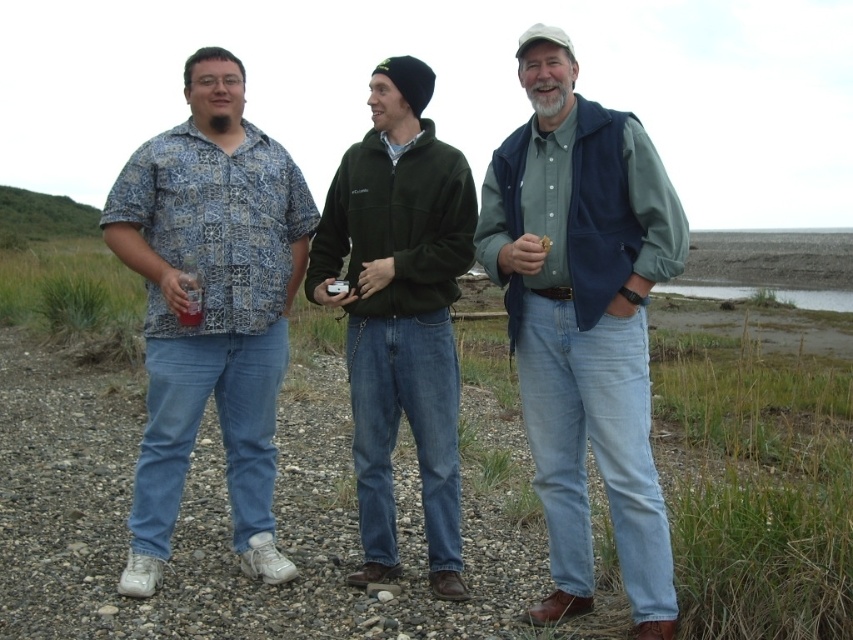
You are trying to find the person wearing the navy blue vest at center and the green fleece jacket at center in the image. Which one is located to the right of the other?

The navy blue vest at center is positioned on the right side of green fleece jacket at center, so the navy blue vest at center is to the right of the green fleece jacket at center.

You are planning to take a photo of the two people wearing the navy blue vest at center and the patterned fabric shirt at left. Which one should you focus on first if you want to capture them both in the frame without moving the camera?

You should focus on the navy blue vest at center first because it is positioned under the patterned fabric shirt at left, meaning it is closer to the camera and would be in focus first if you start from the front.